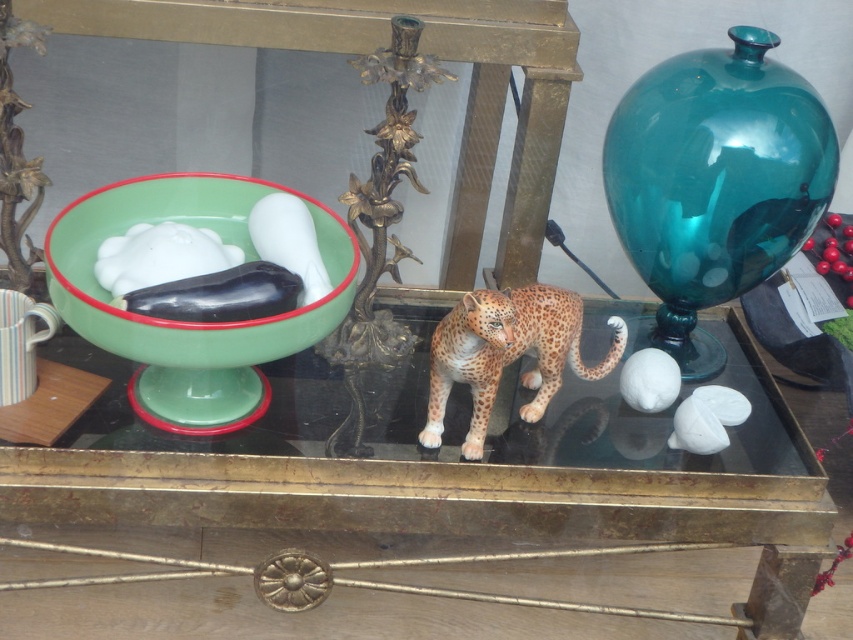
Question: Does glossy glass table at center have a larger size compared to spotted fur cheetah at center?

Choices:
 (A) yes
 (B) no

Answer: (A)

Question: Which object appears farthest from the camera in this image?

Choices:
 (A) glossy glass table at center
 (B) green glass bowl at left
 (C) spotted fur cheetah at center

Answer: (A)

Question: Does glossy glass table at center appear on the right side of green glass bowl at left?

Choices:
 (A) yes
 (B) no

Answer: (A)

Question: Which of the following is the farthest from the observer?

Choices:
 (A) green glass bowl at left
 (B) spotted fur cheetah at center
 (C) glossy glass table at center

Answer: (C)

Question: Which point is farther from the camera taking this photo?

Choices:
 (A) click(x=567, y=307)
 (B) click(x=113, y=346)

Answer: (A)

Question: Is the position of glossy glass table at center more distant than that of green glass bowl at left?

Choices:
 (A) no
 (B) yes

Answer: (B)